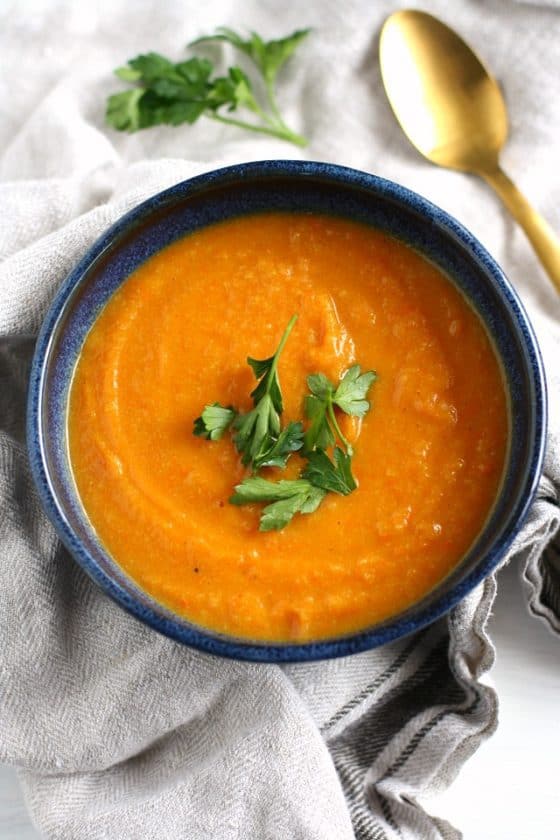
This screenshot has height=840, width=560. I want to click on golden spoon bowl, so click(x=424, y=71).